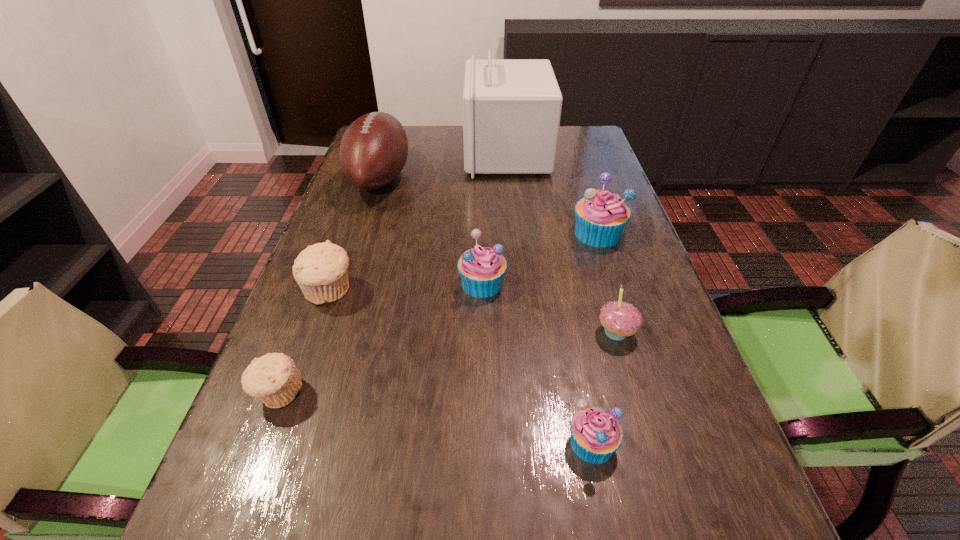
The width and height of the screenshot is (960, 540). What are the coordinates of `free spot that satisfies the following two spatial constraints: 1. on the back side of the third muffin from left to right; 2. on the left side of the bigger beige muffin` in the screenshot? It's located at (331, 283).

Locate an element on the screen. vacant position in the image that satisfies the following two spatial constraints: 1. on the front side of the seventh farthest object; 2. on the left side of the nearest blue muffin is located at coordinates (259, 443).

Find the location of a particular element. The height and width of the screenshot is (540, 960). vacant space that satisfies the following two spatial constraints: 1. on the front side of the third nearest object; 2. on the left side of the farther beige muffin is located at coordinates pyautogui.click(x=314, y=333).